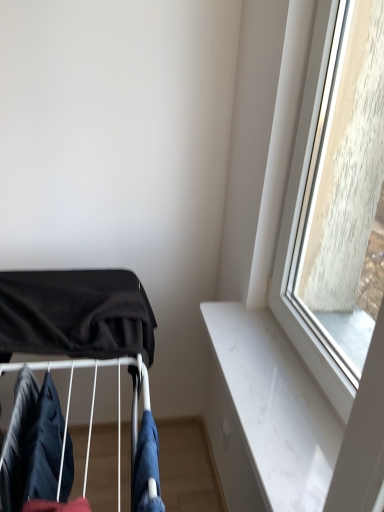
Question: Is black fabric baby carriage at left in front of or behind dark blue fabric at lower left, positioned as the 3th clothing in right-to-left order, in the image?

Choices:
 (A) behind
 (B) front

Answer: (A)

Question: Considering the positions of point (148, 409) and point (6, 475), is point (148, 409) closer or farther from the camera than point (6, 475)?

Choices:
 (A) closer
 (B) farther

Answer: (B)

Question: Which object is positioned farthest from the black fabric baby carriage at left?

Choices:
 (A) dark blue fabric at lower left, positioned as the 3th clothing in right-to-left order
 (B) denim fabric at lower center, which is the 1th clothing from right to left
 (C) dark blue fabric at lower left, the 2th clothing positioned from the left

Answer: (B)

Question: Which is farther from the dark blue fabric at lower left, the 1th clothing in the left-to-right sequence?

Choices:
 (A) denim fabric at lower center, the third clothing when ordered from left to right
 (B) black fabric baby carriage at left
 (C) dark blue fabric at lower left, the 2th clothing positioned from the left

Answer: (A)